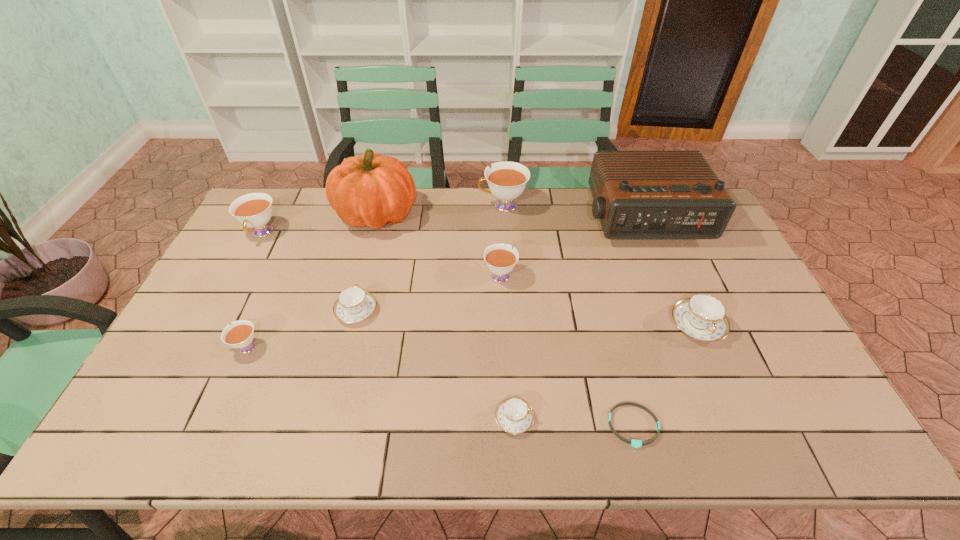
Identify the location of free space located 0.050m on the side of the third white teacup from right to left with the handle. (209, 347).

At what (x,y) coordinates should I click in order to perform the action: click on vacant region located 0.120m on the side of the third white teacup from right to left with the handle. Please return your answer as a coordinate pair (x, y). Looking at the image, I should click on (182, 347).

In order to click on free location located 0.360m on the side with the handle of the second smallest blue teacup in this screenshot , I will do `click(379, 218)`.

This screenshot has height=540, width=960. I want to click on free space located 0.080m on the side with the handle of the second smallest blue teacup, so click(x=365, y=275).

I want to click on vacant space located on the side with the handle of the second smallest blue teacup, so click(x=374, y=237).

Where is `vacant space located on the side with the handle of the nearest blue teacup`? This screenshot has width=960, height=540. vacant space located on the side with the handle of the nearest blue teacup is located at coordinates (560, 418).

Locate an element on the screen. Image resolution: width=960 pixels, height=540 pixels. pumpkin positioned at the far edge is located at coordinates pyautogui.click(x=371, y=190).

Find the location of a particular element. This screenshot has width=960, height=540. radio receiver that is positioned at the far edge is located at coordinates (636, 194).

Identify the location of teacup located at the near edge. This screenshot has width=960, height=540. (514, 415).

Locate an element on the screen. The width and height of the screenshot is (960, 540). wristband situated at the near edge is located at coordinates (634, 443).